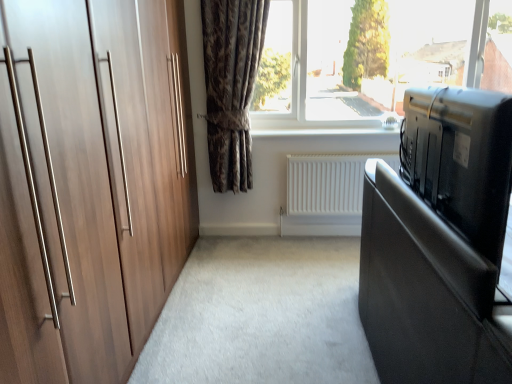
Where is `vacant point above white matte radiator at center (from a real-world perspective)`? vacant point above white matte radiator at center (from a real-world perspective) is located at coordinates (334, 156).